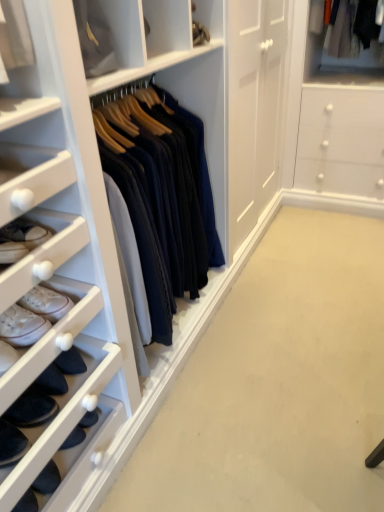
Question: Is dark blue suede shoe at lower left, which is counted as the 2th footwear, starting from the top, bigger than matte white cabinet at upper center?

Choices:
 (A) no
 (B) yes

Answer: (A)

Question: Can you confirm if dark blue suede shoe at lower left, which is counted as the 2th footwear, starting from the top, is smaller than matte white cabinet at upper center?

Choices:
 (A) no
 (B) yes

Answer: (B)

Question: Is dark blue suede shoe at lower left, placed as the 1th footwear when sorted from bottom to top, directly adjacent to matte white cabinet at upper center?

Choices:
 (A) yes
 (B) no

Answer: (B)

Question: Does dark blue suede shoe at lower left, placed as the 1th footwear when sorted from bottom to top, have a lesser width compared to matte white cabinet at upper center?

Choices:
 (A) no
 (B) yes

Answer: (A)

Question: From a real-world perspective, is dark blue suede shoe at lower left, which is counted as the 2th footwear, starting from the top, below matte white cabinet at upper center?

Choices:
 (A) no
 (B) yes

Answer: (B)

Question: Relative to matte white cabinet at upper center, is dark blue suede shoe at lower left, placed as the 1th footwear when sorted from bottom to top, in front or behind?

Choices:
 (A) front
 (B) behind

Answer: (A)

Question: Based on their sizes in the image, would you say dark blue suede shoe at lower left, which is counted as the 2th footwear, starting from the top, is bigger or smaller than matte white cabinet at upper center?

Choices:
 (A) small
 (B) big

Answer: (A)

Question: From the image's perspective, is dark blue suede shoe at lower left, which is counted as the 2th footwear, starting from the top, above or below matte white cabinet at upper center?

Choices:
 (A) below
 (B) above

Answer: (A)

Question: Would you say dark blue suede shoe at lower left, which is counted as the 2th footwear, starting from the top, is to the left or to the right of matte white cabinet at upper center in the picture?

Choices:
 (A) left
 (B) right

Answer: (A)

Question: Considering the positions of dark blue suede shoe at lower left, placed as the 1th footwear when sorted from bottom to top, and white leather sneakers at lower left, arranged as the 1th footwear when viewed from the top, in the image, is dark blue suede shoe at lower left, placed as the 1th footwear when sorted from bottom to top, bigger or smaller than white leather sneakers at lower left, arranged as the 1th footwear when viewed from the top,?

Choices:
 (A) big
 (B) small

Answer: (A)

Question: From a real-world perspective, is dark blue suede shoe at lower left, placed as the 1th footwear when sorted from bottom to top, above or below white leather sneakers at lower left, arranged as the second footwear when ordered from the bottom?

Choices:
 (A) below
 (B) above

Answer: (A)

Question: Does point (16, 437) appear closer or farther from the camera than point (38, 331)?

Choices:
 (A) farther
 (B) closer

Answer: (B)

Question: Is dark blue suede shoe at lower left, placed as the 1th footwear when sorted from bottom to top, to the left or to the right of white leather sneakers at lower left, arranged as the second footwear when ordered from the bottom, in the image?

Choices:
 (A) right
 (B) left

Answer: (B)

Question: From the image's perspective, relative to dark blue suede shoe at lower left, placed as the 1th footwear when sorted from bottom to top, is matte white cabinet at upper center above or below?

Choices:
 (A) below
 (B) above

Answer: (B)

Question: Is matte white cabinet at upper center spatially inside dark blue suede shoe at lower left, which is counted as the 2th footwear, starting from the top, or outside of it?

Choices:
 (A) inside
 (B) outside

Answer: (B)